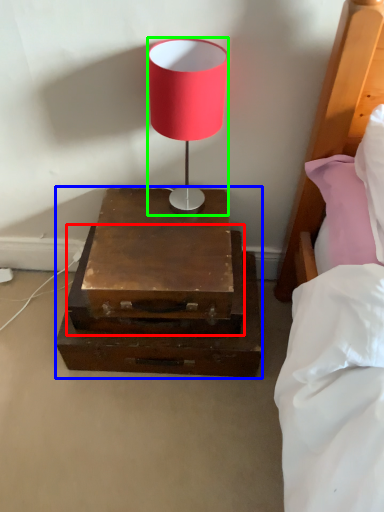
Question: Based on their relative distances, which object is nearer to drawer (highlighted by a red box)? Choose from nightstand (highlighted by a blue box) and lamp (highlighted by a green box).

Choices:
 (A) nightstand
 (B) lamp

Answer: (A)